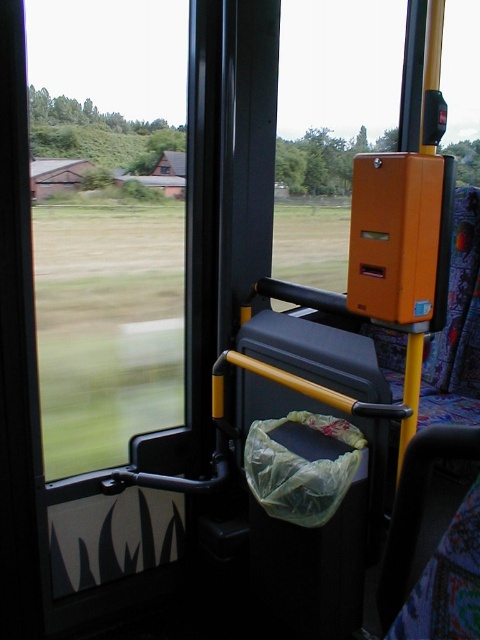
You are a passenger on the bus and want to look outside through the transparent glass window at left. Where should you go to find it?

The transparent glass window at left is located at the coordinates (107, 221) in the image, so you should go to that position to look outside.

You are a passenger on the bus and want to look outside through the transparent glass window at left while also checking the orange plastic at upper center. Which object is closer to you?

The transparent glass window at left is closer to the viewer than the orange plastic at upper center.